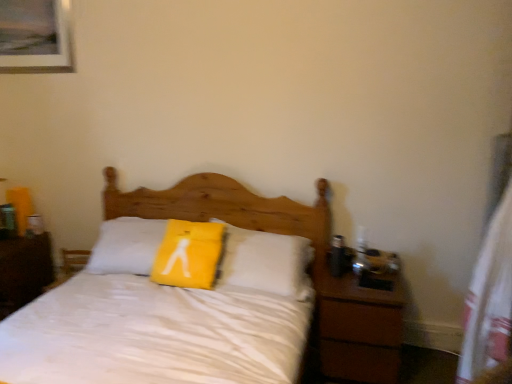
Question: Does white matte bed at center have a smaller size compared to wooden picture frame at upper left?

Choices:
 (A) yes
 (B) no

Answer: (B)

Question: Does white matte bed at center have a lesser width compared to wooden picture frame at upper left?

Choices:
 (A) yes
 (B) no

Answer: (B)

Question: From the image's perspective, does white matte bed at center appear lower than wooden picture frame at upper left?

Choices:
 (A) no
 (B) yes

Answer: (B)

Question: Could wooden picture frame at upper left be considered to be inside white matte bed at center?

Choices:
 (A) yes
 (B) no

Answer: (B)

Question: Does white matte bed at center appear on the right side of wooden picture frame at upper left?

Choices:
 (A) no
 (B) yes

Answer: (B)

Question: Is wooden picture frame at upper left in front of or behind brown wood nightstand at left, which ranks as the 2th nightstand in right-to-left order, in the image?

Choices:
 (A) behind
 (B) front

Answer: (A)

Question: Is wooden picture frame at upper left taller or shorter than brown wood nightstand at left, which ranks as the 2th nightstand in right-to-left order?

Choices:
 (A) short
 (B) tall

Answer: (A)

Question: Visually, is wooden picture frame at upper left positioned to the left or to the right of brown wood nightstand at left, which ranks as the 2th nightstand in right-to-left order?

Choices:
 (A) right
 (B) left

Answer: (A)

Question: From the image's perspective, is wooden picture frame at upper left above or below brown wood nightstand at left, which ranks as the 2th nightstand in right-to-left order?

Choices:
 (A) above
 (B) below

Answer: (A)

Question: From the image's perspective, is white matte bed at center above or below wooden picture frame at upper left?

Choices:
 (A) below
 (B) above

Answer: (A)

Question: Relative to wooden picture frame at upper left, is white matte bed at center in front or behind?

Choices:
 (A) behind
 (B) front

Answer: (B)

Question: Choose the correct answer: Is white matte bed at center inside wooden picture frame at upper left or outside it?

Choices:
 (A) inside
 (B) outside

Answer: (B)

Question: In terms of size, does white matte bed at center appear bigger or smaller than wooden picture frame at upper left?

Choices:
 (A) big
 (B) small

Answer: (A)

Question: Is yellow fabric pillow at center spatially inside wooden picture frame at upper left, or outside of it?

Choices:
 (A) outside
 (B) inside

Answer: (A)

Question: From a real-world perspective, is yellow fabric pillow at center physically located above or below wooden picture frame at upper left?

Choices:
 (A) below
 (B) above

Answer: (A)